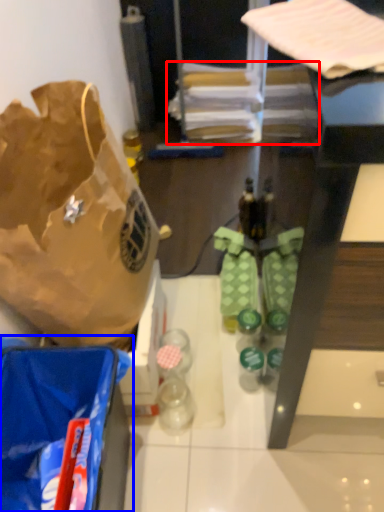
Question: Which of the following is the closest to the observer, wrapping paper (highlighted by a red box) or plastic bag (highlighted by a blue box)?

Choices:
 (A) wrapping paper
 (B) plastic bag

Answer: (B)